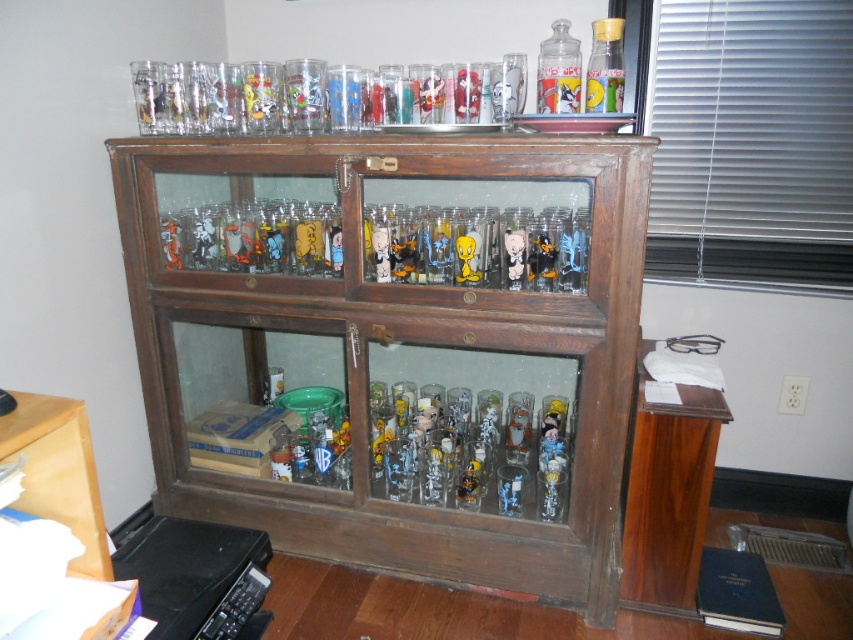
Question: Does clear glass cups at center appear under matte plastic figurine at center?

Choices:
 (A) no
 (B) yes

Answer: (A)

Question: Which object appears closest to the camera in this image?

Choices:
 (A) matte plastic figurine at center
 (B) wooden desk at lower left
 (C) clear glass cups at center

Answer: (B)

Question: Among these points, which one is nearest to the camera?

Choices:
 (A) (556, 77)
 (B) (460, 253)
 (C) (334, 240)
 (D) (169, 250)

Answer: (A)

Question: Is translucent glass figurine at center bigger than matte plastic figurine at center?

Choices:
 (A) yes
 (B) no

Answer: (A)

Question: Among these objects, which one is farthest from the camera?

Choices:
 (A) translucent plastic cup at center
 (B) translucent plastic tweety bird at center

Answer: (A)

Question: In this image, where is clear glass cabinet at upper center located relative to clear glass bottle at upper right?

Choices:
 (A) left
 (B) right

Answer: (A)